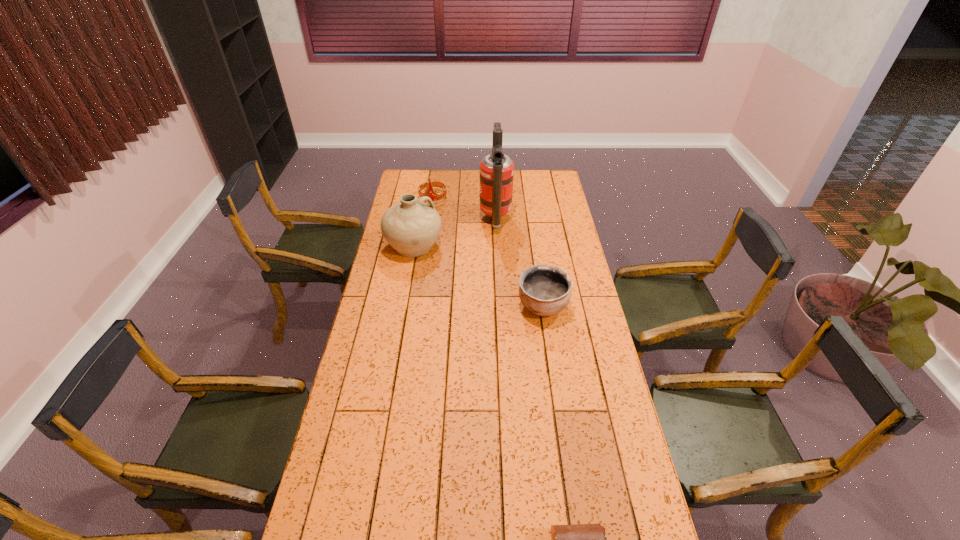
Find the location of a particular element. Image resolution: width=960 pixels, height=540 pixels. free space that satisfies the following two spatial constraints: 1. on the front label side of the fourth farthest object; 2. on the left side of the tallest object is located at coordinates 499,307.

Locate an element on the screen. This screenshot has width=960, height=540. free space that satisfies the following two spatial constraints: 1. on the front-facing side of the nearer pottery; 2. on the left side of the third tallest object is located at coordinates (418, 307).